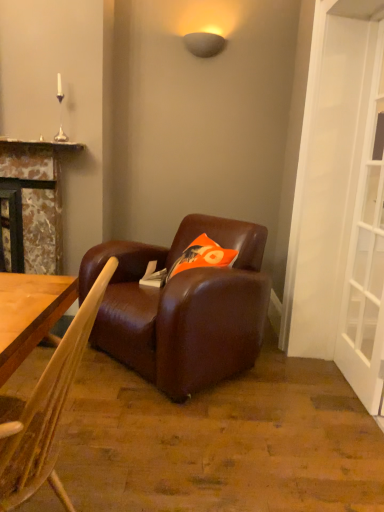
The height and width of the screenshot is (512, 384). Find the location of `brown leather couch at center`. brown leather couch at center is located at coordinates (183, 308).

The image size is (384, 512). What do you see at coordinates (203, 256) in the screenshot?
I see `orange fabric pillow at center` at bounding box center [203, 256].

The image size is (384, 512). Find the location of `white glass screen door at right`. white glass screen door at right is located at coordinates pos(366,258).

Where is `brown leather couch at center`? The image size is (384, 512). brown leather couch at center is located at coordinates (183, 308).

From the image's perspective, which one is positioned higher, white glass screen door at right or orange fabric pillow at center?

white glass screen door at right.

Is white glass screen door at right spatially inside orange fabric pillow at center, or outside of it?

white glass screen door at right is not inside orange fabric pillow at center, it's outside.

Considering the sizes of objects white glass screen door at right and orange fabric pillow at center in the image provided, who is thinner, white glass screen door at right or orange fabric pillow at center?

With smaller width is white glass screen door at right.

From a real-world perspective, who is located lower, white glass screen door at right or orange fabric pillow at center?

orange fabric pillow at center is physically lower.

From a real-world perspective, which object rests below the other?

From a 3D spatial view, brown leather couch at center is below.

Is brown leather couch at center further to the viewer compared to white glass screen door at right?

Yes, the depth of brown leather couch at center is greater than that of white glass screen door at right.

Between brown leather couch at center and white glass screen door at right, which one has smaller width?

Thinner between the two is white glass screen door at right.

Could you tell me if brown leather couch at center is facing white glass screen door at right?

No, brown leather couch at center does not turn towards white glass screen door at right.

Considering the sizes of brown leather couch at center and orange fabric pillow at center in the image, is brown leather couch at center bigger or smaller than orange fabric pillow at center?

Clearly, brown leather couch at center is larger in size than orange fabric pillow at center.

Is point (242, 288) more distant than point (218, 261)?

No, it is in front of (218, 261).

Is brown leather couch at center inside the boundaries of orange fabric pillow at center, or outside?

brown leather couch at center is outside orange fabric pillow at center.

From a real-world perspective, which is physically above, brown leather couch at center or orange fabric pillow at center?

orange fabric pillow at center, from a real-world perspective.

Could you tell me if brown leather chair at center is facing white glass screen door at right?

No.

Considering the positions of objects brown leather chair at center and white glass screen door at right in the image provided, who is in front, brown leather chair at center or white glass screen door at right?

Positioned in front is brown leather chair at center.

Based on the photo, which point is more distant from viewer, (75, 337) or (367, 315)?

The point (367, 315) is behind.

Is brown leather chair at center surrounding white glass screen door at right?

Actually, white glass screen door at right is outside brown leather chair at center.

Is white glass screen door at right facing away from brown leather couch at center?

No, brown leather couch at center is not at the back of white glass screen door at right.

Where is `screen door positioned vertically above the brown leather couch at center (from a real-world perspective)`? screen door positioned vertically above the brown leather couch at center (from a real-world perspective) is located at coordinates (366, 258).

Which is behind, white glass screen door at right or brown leather couch at center?

brown leather couch at center is further away from the camera.

Is white glass screen door at right at the left side of brown leather couch at center?

No.

How many degrees apart are the facing directions of orange fabric pillow at center and brown leather chair at center?

The angular difference between orange fabric pillow at center and brown leather chair at center is 15.4 degrees.

Between point (216, 256) and point (85, 319), which one is positioned behind?

The point (216, 256) is more distant.

Is orange fabric pillow at center in contact with brown leather chair at center?

They are not placed beside each other.

Considering the sizes of orange fabric pillow at center and brown leather chair at center in the image, is orange fabric pillow at center bigger or smaller than brown leather chair at center?

Considering their sizes, orange fabric pillow at center takes up less space than brown leather chair at center.

Between brown leather couch at center and brown leather chair at center, which one has less height?

brown leather couch at center is shorter.

Does brown leather couch at center have a lesser width compared to brown leather chair at center?

In fact, brown leather couch at center might be wider than brown leather chair at center.

Is brown leather couch at center inside the boundaries of brown leather chair at center, or outside?

brown leather couch at center is not enclosed by brown leather chair at center.

Identify the location of screen door above the orange fabric pillow at center (from a real-world perspective). This screenshot has width=384, height=512. (366, 258).

Find the location of a particular element. The height and width of the screenshot is (512, 384). screen door located above the brown leather couch at center (from the image's perspective) is located at coordinates (366, 258).

When comparing their distances from brown leather couch at center, does brown leather chair at center or white glass screen door at right seem further?

brown leather chair at center lies further to brown leather couch at center than the other object.

From the image, which object appears to be farther from brown leather couch at center, brown leather chair at center or orange fabric pillow at center?

Among the two, brown leather chair at center is located further to brown leather couch at center.

Consider the image. Looking at the image, which one is located closer to white glass screen door at right, orange fabric pillow at center or brown leather couch at center?

Based on the image, orange fabric pillow at center appears to be nearer to white glass screen door at right.

Estimate the real-world distances between objects in this image. Which object is closer to brown leather chair at center, brown leather couch at center or white glass screen door at right?

brown leather couch at center is closer to brown leather chair at center.

Which object lies further to the anchor point brown leather chair at center, orange fabric pillow at center or brown leather couch at center?

Among the two, orange fabric pillow at center is located further to brown leather chair at center.

Estimate the real-world distances between objects in this image. Which object is closer to white glass screen door at right, brown leather couch at center or orange fabric pillow at center?

The object closer to white glass screen door at right is orange fabric pillow at center.

Estimate the real-world distances between objects in this image. Which object is further from orange fabric pillow at center, brown leather couch at center or white glass screen door at right?

white glass screen door at right.

Considering their positions, is white glass screen door at right positioned closer to brown leather chair at center than orange fabric pillow at center?

orange fabric pillow at center lies closer to brown leather chair at center than the other object.

Identify the location of pillow between brown leather couch at center and white glass screen door at right from left to right. (203, 256).

What are the coordinates of `screen door positioned between brown leather chair at center and orange fabric pillow at center from near to far` in the screenshot? It's located at (366, 258).

In order to click on studio couch positioned between brown leather chair at center and orange fabric pillow at center from near to far in this screenshot , I will do `click(183, 308)`.

Find the location of a particular element. studio couch situated between brown leather chair at center and white glass screen door at right from left to right is located at coordinates (183, 308).